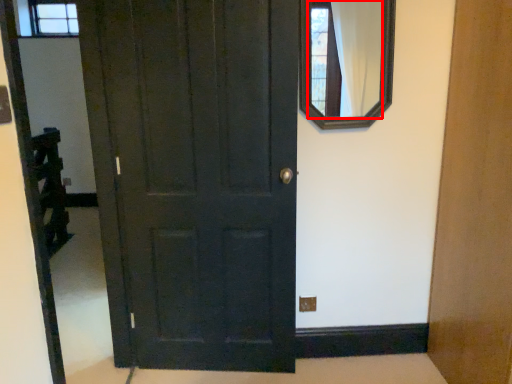
Question: From the image's perspective, where is mirror (annotated by the red box) located in relation to door in the image?

Choices:
 (A) above
 (B) below

Answer: (A)